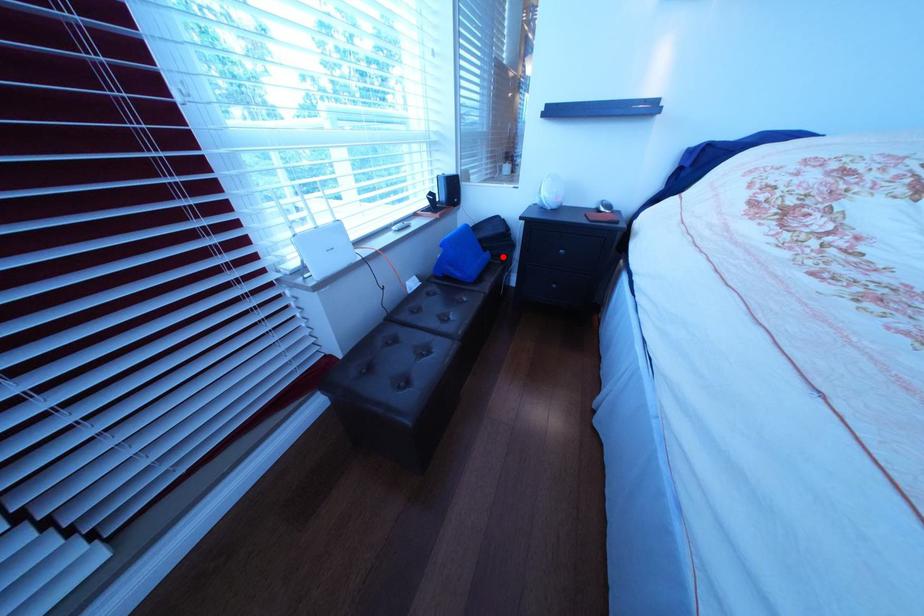
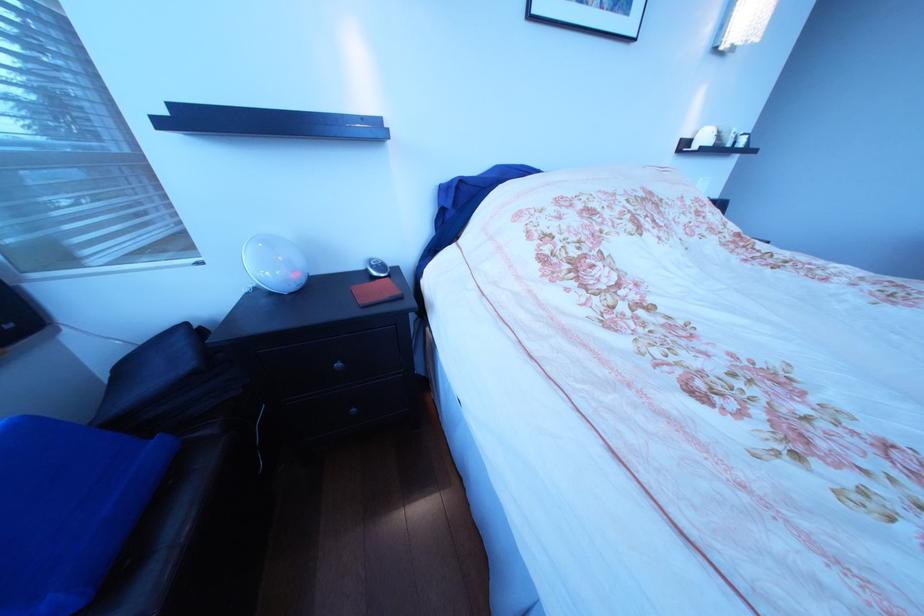
Question: I am providing you with two images of the same scene from different viewpoints. Image1 has a red point marked. In image2, the corresponding 3D location appears at what relative position? Reply with the corresponding letter.

Choices:
 (A) Closer
 (B) Farther

Answer: (B)